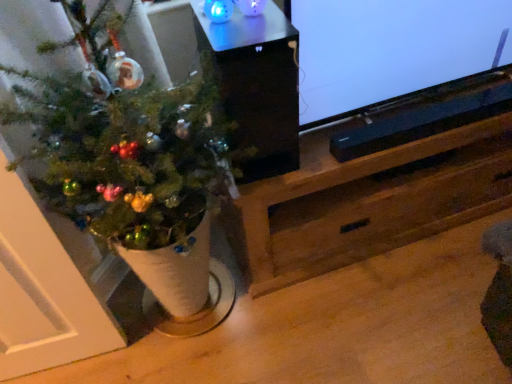
Question: From a real-world perspective, is black plastic soundbar at lower center positioned above or below black glossy speaker at upper center?

Choices:
 (A) above
 (B) below

Answer: (B)

Question: Does point (330, 139) appear closer or farther from the camera than point (239, 87)?

Choices:
 (A) farther
 (B) closer

Answer: (A)

Question: Which of these objects is positioned closest to the black plastic soundbar at lower center?

Choices:
 (A) matte black speaker at upper right
 (B) black glossy speaker at upper center
 (C) green matte christmas tree at left

Answer: (A)

Question: Based on their relative distances, which object is farther from the black glossy speaker at upper center?

Choices:
 (A) matte black speaker at upper right
 (B) green matte christmas tree at left
 (C) black plastic soundbar at lower center

Answer: (C)